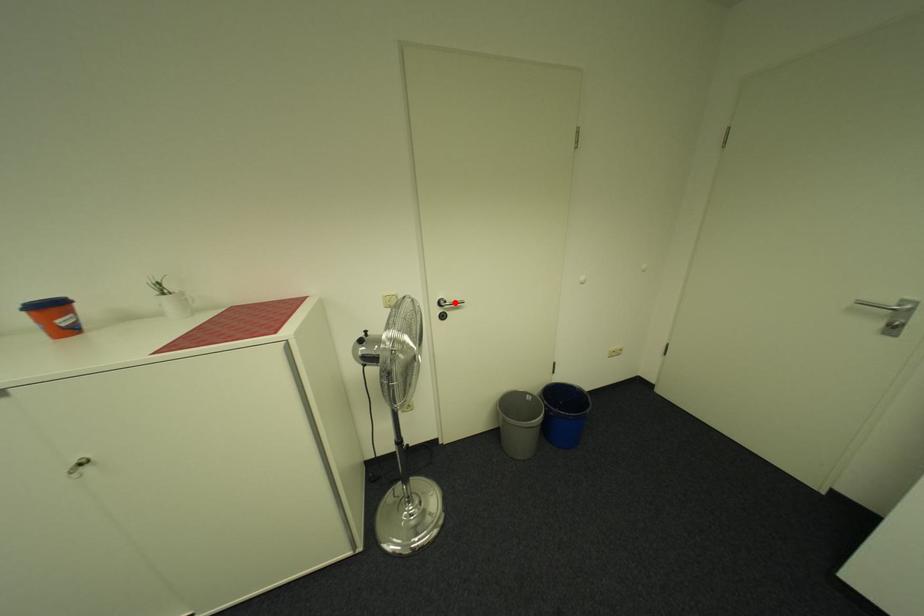
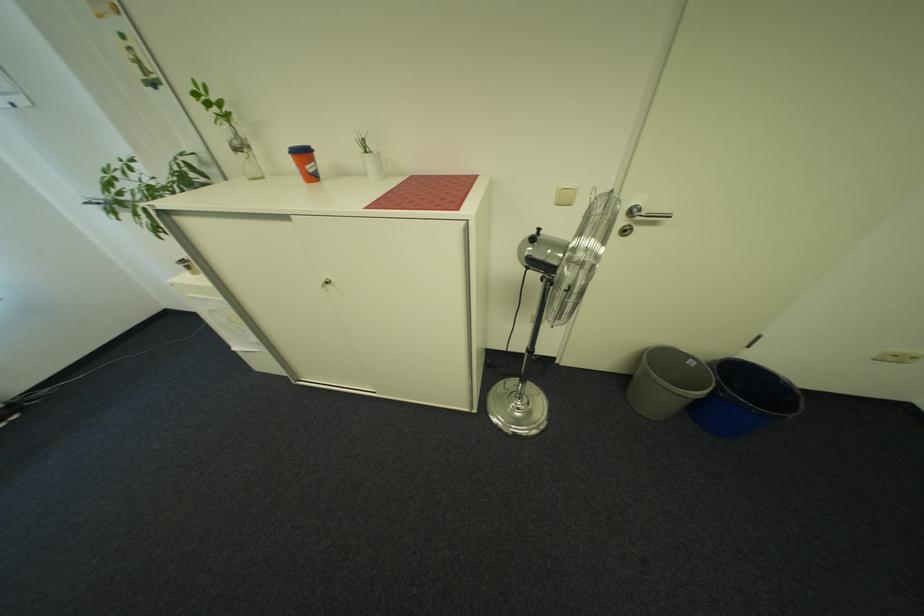
Locate, in the second image, the point that corresponds to the highlighted location in the first image.

(650, 211)